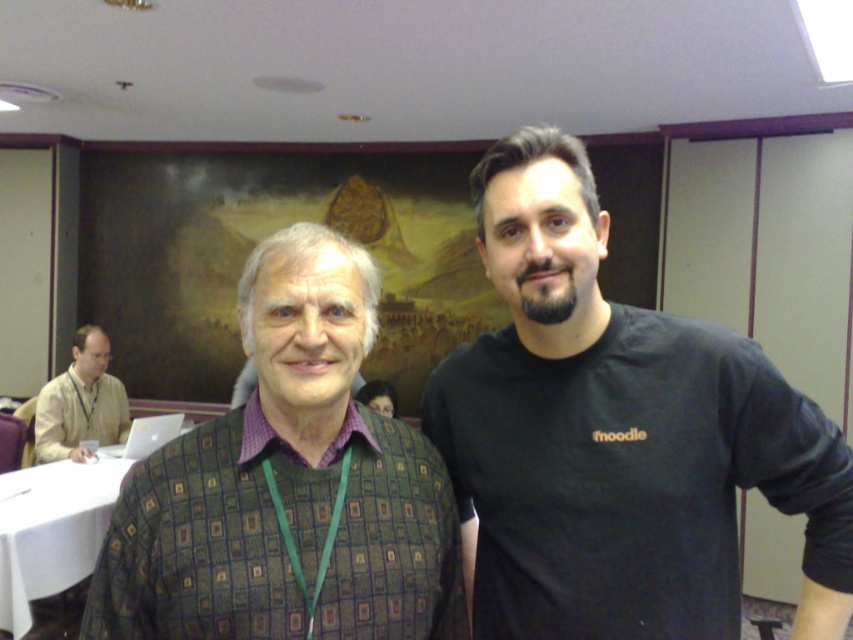
Can you confirm if green textured sweater at center is bigger than purple woven shirt at center?

Yes, green textured sweater at center is bigger than purple woven shirt at center.

Is green textured sweater at center positioned before purple woven shirt at center?

Yes, green textured sweater at center is in front of purple woven shirt at center.

What do you see at coordinates (281, 538) in the screenshot?
I see `green textured sweater at center` at bounding box center [281, 538].

Image resolution: width=853 pixels, height=640 pixels. Find the location of `green textured sweater at center`. green textured sweater at center is located at coordinates 281,538.

Which is behind, point (830, 525) or point (408, 428)?

The point (408, 428) is more distant.

Is black matte shirt at center above green textured sweater at center?

Correct, black matte shirt at center is located above green textured sweater at center.

At what (x,y) coordinates should I click in order to perform the action: click on black matte shirt at center. Please return your answer as a coordinate pair (x, y). Looking at the image, I should click on (616, 436).

Between point (665, 577) and point (49, 435), which one is positioned behind?

The point (49, 435) is behind.

Can you confirm if black matte shirt at center is thinner than beige fabric shirt at left?

No.

Is point (438, 380) positioned behind point (85, 385)?

No, it is in front of (85, 385).

Where is `black matte shirt at center`? black matte shirt at center is located at coordinates (616, 436).